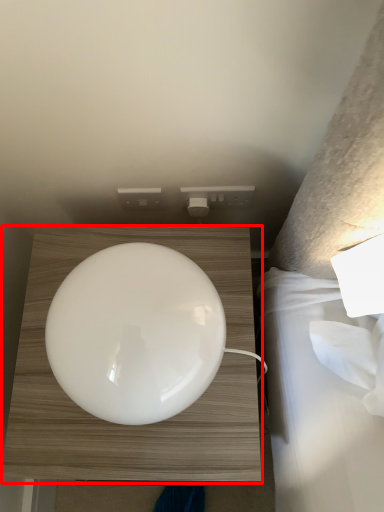
Question: From the image's perspective, what is the correct spatial relationship of furniture (annotated by the red box) in relation to electric outlet?

Choices:
 (A) above
 (B) below

Answer: (B)